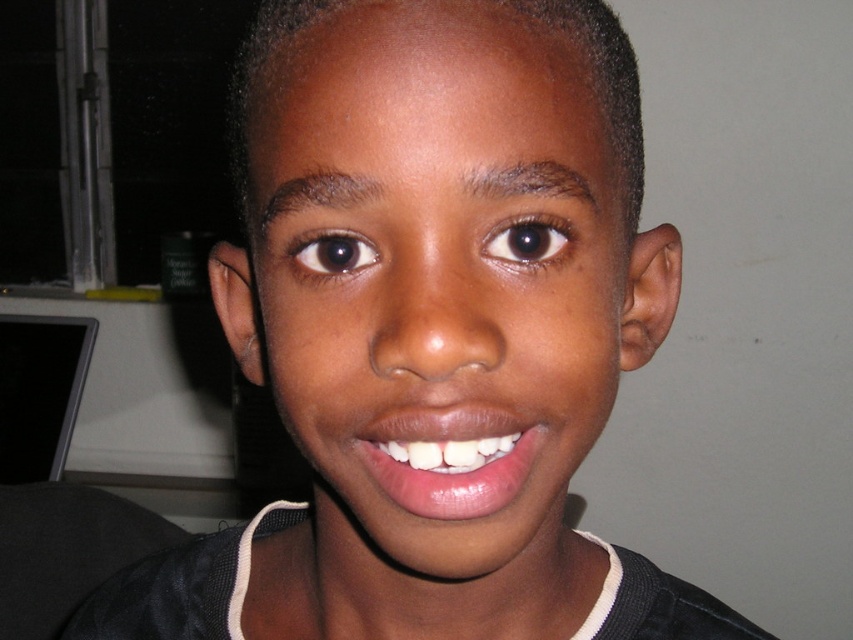
Does brown matte eye at upper center have a larger size compared to brown shiny eye at center?

No.

Which is more to the left, brown matte eye at upper center or brown shiny eye at center?

Positioned to the left is brown shiny eye at center.

Is point (512, 252) positioned behind point (314, 269)?

No, (512, 252) is in front of (314, 269).

Locate an element on the screen. The width and height of the screenshot is (853, 640). brown matte eye at upper center is located at coordinates (526, 241).

Between smooth glossy lips at center and brown matte eye at upper center, which one has less height?

Standing shorter between the two is brown matte eye at upper center.

Does smooth glossy lips at center appear on the right side of brown matte eye at upper center?

No, smooth glossy lips at center is not to the right of brown matte eye at upper center.

This screenshot has width=853, height=640. I want to click on smooth glossy lips at center, so click(450, 458).

Between point (398, 433) and point (299, 260), which one is positioned behind?

The point (299, 260) is behind.

Where is `smooth glossy lips at center`? The height and width of the screenshot is (640, 853). smooth glossy lips at center is located at coordinates (450, 458).